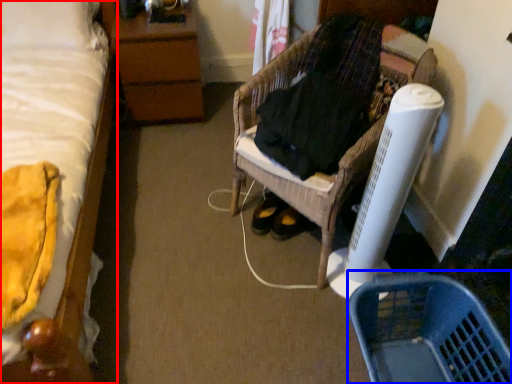
Question: Among these objects, which one is nearest to the camera, bed (highlighted by a red box) or basket (highlighted by a blue box)?

Choices:
 (A) bed
 (B) basket

Answer: (A)